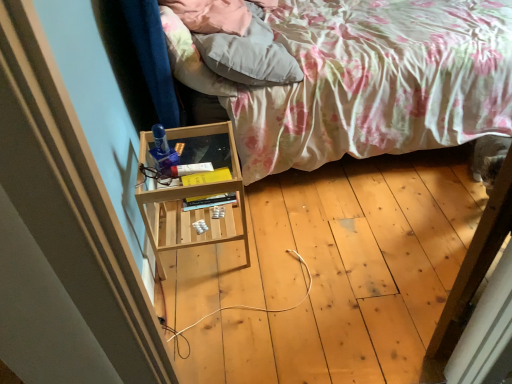
Measure the distance between fluffy white pillow at upper center and camera.

A distance of 5.22 feet exists between fluffy white pillow at upper center and camera.

What is the approximate width of fluffy white pillow at upper center?

15.82 inches.

The image size is (512, 384). In order to click on fluffy white pillow at upper center in this screenshot , I will do `click(249, 53)`.

What do you see at coordinates (249, 53) in the screenshot?
I see `fluffy white pillow at upper center` at bounding box center [249, 53].

Where is `floral fabric bed at center`? floral fabric bed at center is located at coordinates (365, 80).

Image resolution: width=512 pixels, height=384 pixels. What do you see at coordinates (365, 80) in the screenshot?
I see `floral fabric bed at center` at bounding box center [365, 80].

In order to face floral fabric bed at center, should I rotate leftwards or rightwards?

To face it directly, rotate right by 13.615 degrees.

In order to click on fluffy white pillow at upper center in this screenshot , I will do `click(249, 53)`.

Considering the relative positions of fluffy white pillow at upper center and floral fabric bed at center in the image provided, is fluffy white pillow at upper center to the left of floral fabric bed at center from the viewer's perspective?

Yes.

Is fluffy white pillow at upper center positioned in front of floral fabric bed at center?

No, the depth of fluffy white pillow at upper center is greater than that of floral fabric bed at center.

Considering the points (249, 38) and (494, 104), which point is in front, point (249, 38) or point (494, 104)?

The point (249, 38) is closer to the camera.

From the image's perspective, between fluffy white pillow at upper center and floral fabric bed at center, who is located below?

fluffy white pillow at upper center, from the image's perspective.

Based on the photo, from a real-world perspective, which object rests below the other?

floral fabric bed at center is physically lower.

Does fluffy white pillow at upper center have a greater width compared to floral fabric bed at center?

No, fluffy white pillow at upper center is not wider than floral fabric bed at center.

Is fluffy white pillow at upper center taller than floral fabric bed at center?

No.

Which of these two, fluffy white pillow at upper center or floral fabric bed at center, is smaller?

Smaller between the two is fluffy white pillow at upper center.

Is fluffy white pillow at upper center inside or outside of floral fabric bed at center?

fluffy white pillow at upper center fits inside floral fabric bed at center.

Does fluffy white pillow at upper center touch floral fabric bed at center?

There is a gap between fluffy white pillow at upper center and floral fabric bed at center.

Is fluffy white pillow at upper center facing away from floral fabric bed at center?

Yes, floral fabric bed at center is at the back of fluffy white pillow at upper center.

How far apart are fluffy white pillow at upper center and floral fabric bed at center?

fluffy white pillow at upper center is 12.16 inches from floral fabric bed at center.

Find the location of a particular element. The image size is (512, 384). bed located above the fluffy white pillow at upper center (from the image's perspective) is located at coordinates (365, 80).

Consider the image. Considering the relative positions of floral fabric bed at center and fluffy white pillow at upper center in the image provided, is floral fabric bed at center to the left of fluffy white pillow at upper center from the viewer's perspective?

Incorrect, floral fabric bed at center is not on the left side of fluffy white pillow at upper center.

Which object is closer to the camera, floral fabric bed at center or fluffy white pillow at upper center?

floral fabric bed at center is in front.

Which is nearer, (272, 137) or (256, 36)?

The point (256, 36) is more forward.

From the image's perspective, which one is positioned lower, floral fabric bed at center or fluffy white pillow at upper center?

fluffy white pillow at upper center is shown below in the image.

From a real-world perspective, is floral fabric bed at center on top of fluffy white pillow at upper center?

No.

Considering the relative sizes of floral fabric bed at center and fluffy white pillow at upper center in the image provided, is floral fabric bed at center thinner than fluffy white pillow at upper center?

No.

Which of these two, floral fabric bed at center or fluffy white pillow at upper center, stands shorter?

fluffy white pillow at upper center is shorter.

Between floral fabric bed at center and fluffy white pillow at upper center, which one has smaller size?

fluffy white pillow at upper center.

Is floral fabric bed at center completely or partially outside of fluffy white pillow at upper center?

floral fabric bed at center lies outside fluffy white pillow at upper center's area.

Is floral fabric bed at center next to fluffy white pillow at upper center?

No, floral fabric bed at center is not making contact with fluffy white pillow at upper center.

Is floral fabric bed at center oriented towards fluffy white pillow at upper center?

No, floral fabric bed at center is not turned towards fluffy white pillow at upper center.

Locate an element on the screen. The height and width of the screenshot is (384, 512). pillow above the floral fabric bed at center (from a real-world perspective) is located at coordinates (249, 53).

What are the coordinates of `pillow on the left of floral fabric bed at center` in the screenshot? It's located at (249, 53).

This screenshot has height=384, width=512. What are the coordinates of `pillow below the floral fabric bed at center (from the image's perspective)` in the screenshot? It's located at (249, 53).